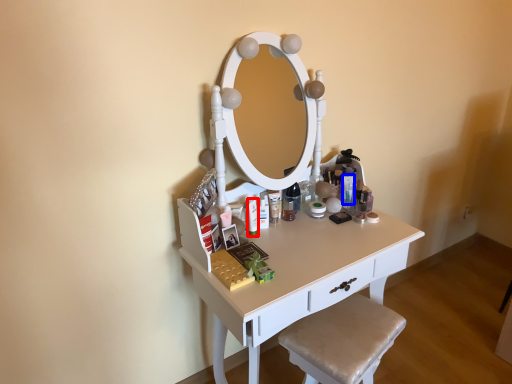
Question: Which of the following is the farthest to the observer, toiletry (highlighted by a red box) or toiletry (highlighted by a blue box)?

Choices:
 (A) toiletry
 (B) toiletry

Answer: (B)